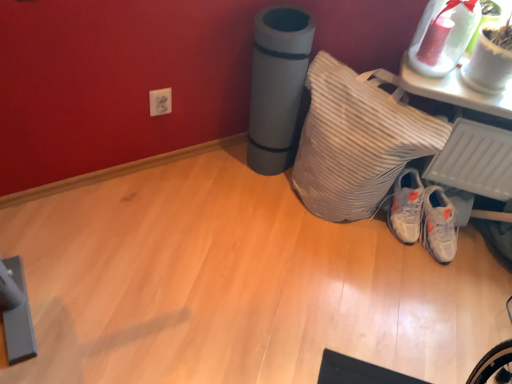
Question: From the image's perspective, is white striped pillow at lower right located beneath white glossy vase at upper right?

Choices:
 (A) no
 (B) yes

Answer: (B)

Question: From a real-world perspective, is white striped pillow at lower right on white glossy vase at upper right?

Choices:
 (A) no
 (B) yes

Answer: (A)

Question: Is white striped pillow at lower right to the left of white glossy vase at upper right from the viewer's perspective?

Choices:
 (A) no
 (B) yes

Answer: (B)

Question: Is white striped pillow at lower right wider than white glossy vase at upper right?

Choices:
 (A) yes
 (B) no

Answer: (A)

Question: Is white striped pillow at lower right located outside white glossy vase at upper right?

Choices:
 (A) no
 (B) yes

Answer: (B)

Question: Based on their positions, is white striped pillow at lower right located to the left or right of white glossy vase at upper right?

Choices:
 (A) right
 (B) left

Answer: (B)

Question: From the image's perspective, is white striped pillow at lower right positioned above or below white glossy vase at upper right?

Choices:
 (A) below
 (B) above

Answer: (A)

Question: From a real-world perspective, relative to white glossy vase at upper right, is white striped pillow at lower right vertically above or below?

Choices:
 (A) below
 (B) above

Answer: (A)

Question: Is white striped pillow at lower right inside the boundaries of white glossy vase at upper right, or outside?

Choices:
 (A) outside
 (B) inside

Answer: (A)

Question: Considering the positions of white matte sneakers at lower right and white striped pillow at lower right in the image, is white matte sneakers at lower right wider or thinner than white striped pillow at lower right?

Choices:
 (A) thin
 (B) wide

Answer: (A)

Question: Considering the relative positions of white matte sneakers at lower right and white striped pillow at lower right in the image provided, is white matte sneakers at lower right to the left or to the right of white striped pillow at lower right?

Choices:
 (A) right
 (B) left

Answer: (A)

Question: Considering the positions of white matte sneakers at lower right and white striped pillow at lower right in the image, is white matte sneakers at lower right bigger or smaller than white striped pillow at lower right?

Choices:
 (A) small
 (B) big

Answer: (A)

Question: From the image's perspective, relative to white striped pillow at lower right, is white matte sneakers at lower right above or below?

Choices:
 (A) below
 (B) above

Answer: (A)

Question: From a real-world perspective, is white matte sneakers at lower right positioned above or below white glossy vase at upper right?

Choices:
 (A) below
 (B) above

Answer: (A)

Question: In terms of size, does white matte sneakers at lower right appear bigger or smaller than white glossy vase at upper right?

Choices:
 (A) big
 (B) small

Answer: (A)